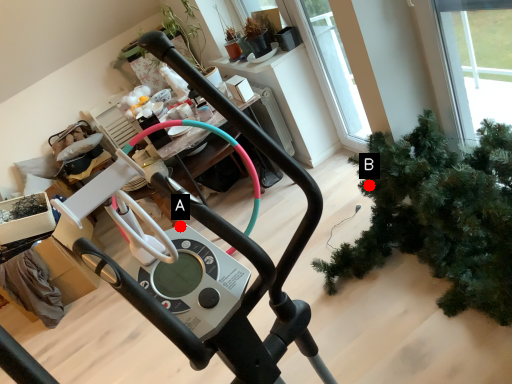
Question: Two points are circled on the image, labeled by A and B beside each circle. Which of the following is the closest to the observer?

Choices:
 (A) A is closer
 (B) B is closer

Answer: (A)